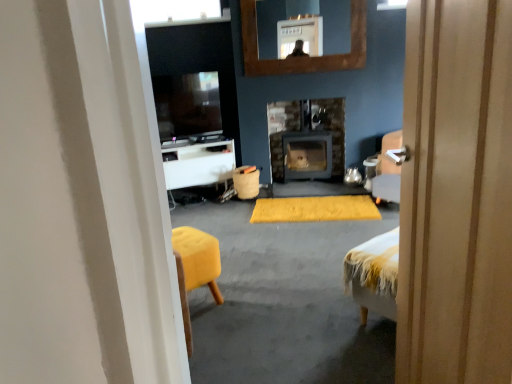
Question: Is matte black wood burning stove at center looking in the opposite direction of transparent glass window at upper center?

Choices:
 (A) no
 (B) yes

Answer: (A)

Question: Can you confirm if matte black wood burning stove at center is positioned to the right of transparent glass window at upper center?

Choices:
 (A) no
 (B) yes

Answer: (B)

Question: From the image's perspective, is matte black wood burning stove at center beneath transparent glass window at upper center?

Choices:
 (A) yes
 (B) no

Answer: (A)

Question: Does matte black wood burning stove at center have a greater height compared to transparent glass window at upper center?

Choices:
 (A) no
 (B) yes

Answer: (B)

Question: Can you confirm if matte black wood burning stove at center is shorter than transparent glass window at upper center?

Choices:
 (A) yes
 (B) no

Answer: (B)

Question: In terms of height, does matte black tv at upper center look taller or shorter compared to wooden door at center?

Choices:
 (A) short
 (B) tall

Answer: (A)

Question: Visually, is matte black tv at upper center positioned to the left or to the right of wooden door at center?

Choices:
 (A) left
 (B) right

Answer: (A)

Question: In terms of width, does matte black tv at upper center look wider or thinner when compared to wooden door at center?

Choices:
 (A) wide
 (B) thin

Answer: (A)

Question: From the image's perspective, is matte black tv at upper center above or below wooden door at center?

Choices:
 (A) above
 (B) below

Answer: (A)

Question: In the image, is yellow fuzzy yoga mat at center on the left side or the right side of wooden door at center?

Choices:
 (A) right
 (B) left

Answer: (A)

Question: Is yellow fuzzy yoga mat at center in front of or behind wooden door at center in the image?

Choices:
 (A) front
 (B) behind

Answer: (B)

Question: Is point (297, 200) closer or farther from the camera than point (501, 269)?

Choices:
 (A) farther
 (B) closer

Answer: (A)

Question: In terms of size, does yellow fuzzy yoga mat at center appear bigger or smaller than wooden door at center?

Choices:
 (A) big
 (B) small

Answer: (B)

Question: In terms of size, does matte black wood burning stove at center appear bigger or smaller than burlap-like fabric trash can at center?

Choices:
 (A) big
 (B) small

Answer: (A)

Question: Is point (x=271, y=119) closer or farther from the camera than point (x=258, y=183)?

Choices:
 (A) farther
 (B) closer

Answer: (A)